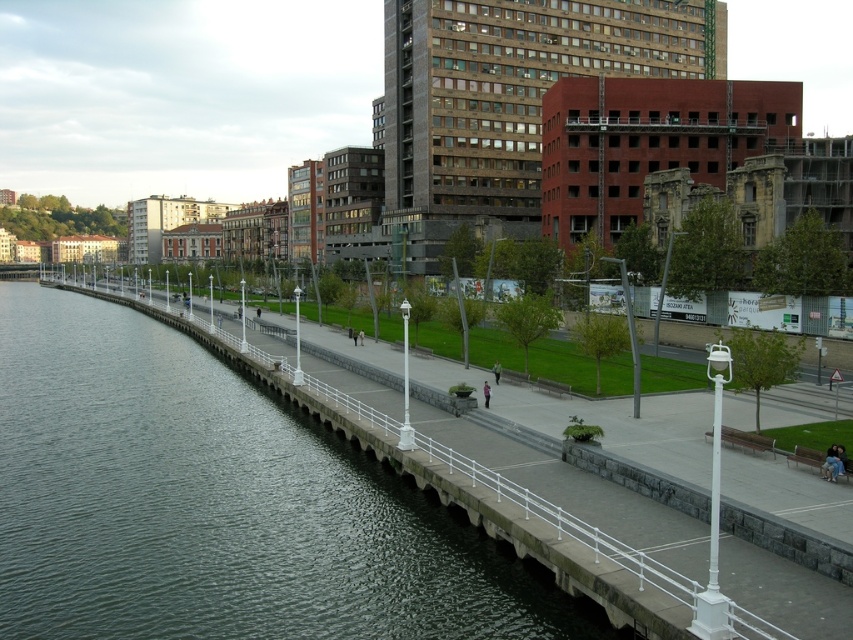
Between white concrete walkway at lower left and pink fabric person at center, which one appears on the right side from the viewer's perspective?

From the viewer's perspective, white concrete walkway at lower left appears more on the right side.

Is the position of white concrete walkway at lower left less distant than that of pink fabric person at center?

Yes, it is.

Is point (369, 353) farther from camera compared to point (489, 397)?

Yes, point (369, 353) is behind point (489, 397).

Where is `white concrete walkway at lower left`? This screenshot has width=853, height=640. white concrete walkway at lower left is located at coordinates (627, 428).

Between point (560, 625) and point (709, 477), which one is positioned behind?

The point (709, 477) is more distant.

Is green concrete river at lower left in front of white concrete walkway at lower left?

Yes, it is.

Identify the location of green concrete river at lower left. (218, 504).

Where is `green concrete river at lower left`? green concrete river at lower left is located at coordinates (218, 504).

Who is lower down, green concrete river at lower left or pink fabric person at center?

pink fabric person at center is lower down.

Which is above, green concrete river at lower left or pink fabric person at center?

green concrete river at lower left is higher up.

What do you see at coordinates (218, 504) in the screenshot?
I see `green concrete river at lower left` at bounding box center [218, 504].

This screenshot has width=853, height=640. I want to click on green concrete river at lower left, so click(218, 504).